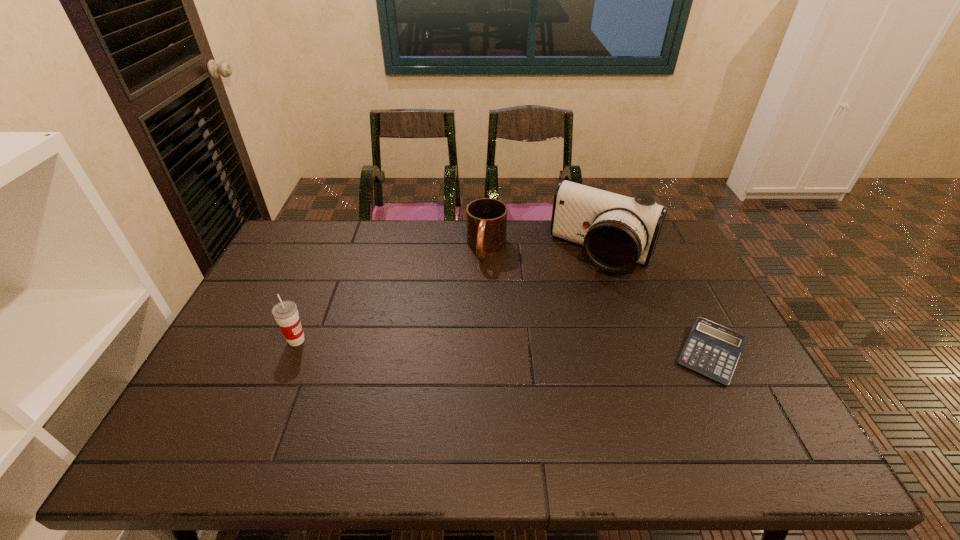
At what (x,y) coordinates should I click in order to perform the action: click on the leftmost object. Please return your answer as a coordinate pair (x, y). The image size is (960, 540). Looking at the image, I should click on (285, 313).

Where is `the second tallest object`? The width and height of the screenshot is (960, 540). the second tallest object is located at coordinates (285, 313).

I want to click on the shortest object, so click(712, 350).

Locate an element on the screen. camcorder is located at coordinates (616, 231).

At what (x,y) coordinates should I click in order to perform the action: click on the second shortest object. Please return your answer as a coordinate pair (x, y). The image size is (960, 540). Looking at the image, I should click on (486, 218).

The height and width of the screenshot is (540, 960). I want to click on mug, so click(x=486, y=218).

The image size is (960, 540). I want to click on free point located on the side of the third shortest object with the logo, so click(241, 340).

What are the coordinates of `free space located 0.060m on the side of the third shortest object with the logo` in the screenshot? It's located at (263, 340).

Find the location of a particular element. This screenshot has width=960, height=540. free space located 0.170m on the side of the third shortest object with the logo is located at coordinates (223, 340).

The width and height of the screenshot is (960, 540). In order to click on free space located on the back of the shortest object in this screenshot , I will do `click(677, 286)`.